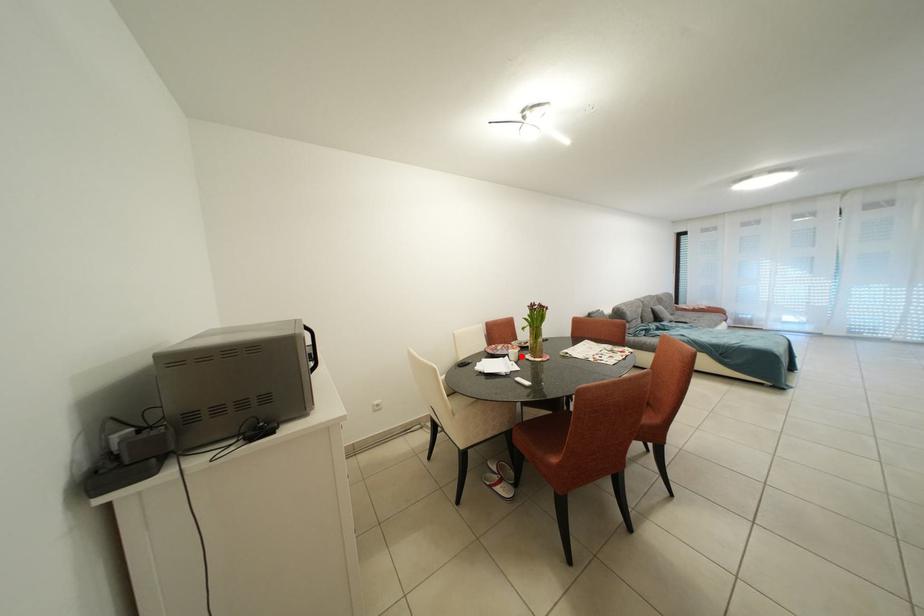
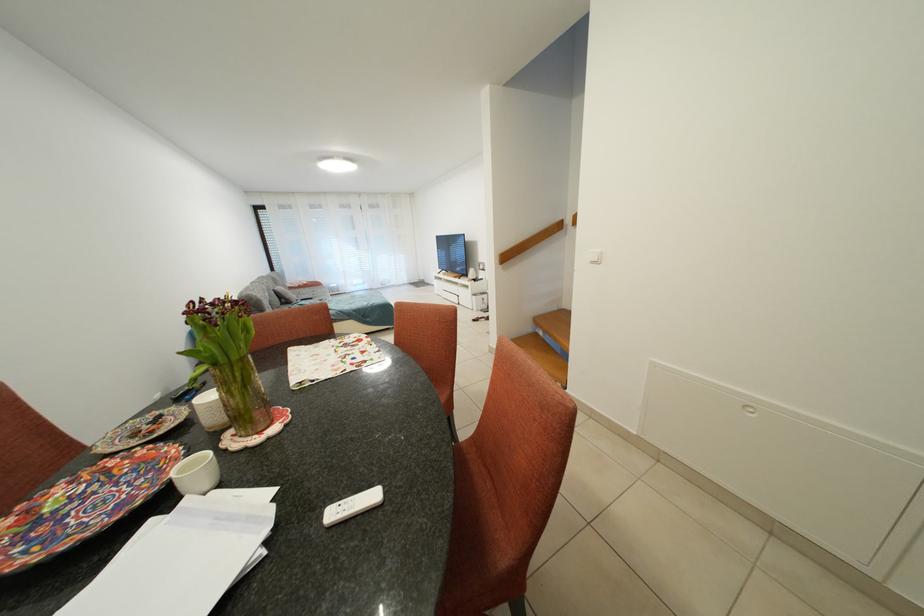
Locate, in the second image, the point that corresponds to the highlighted location in the first image.

(202, 471)